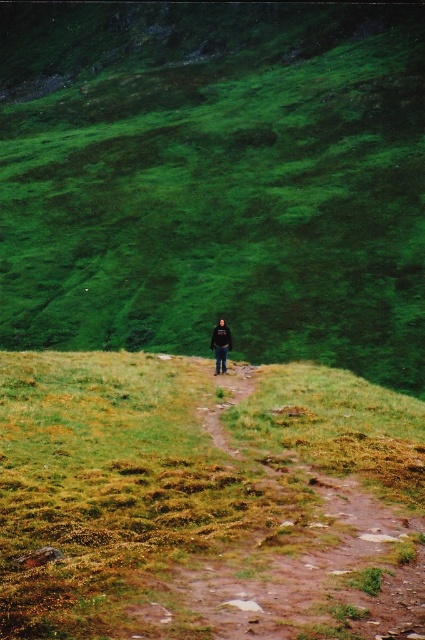
Does point (319, 563) lie in front of point (215, 372)?

That is True.

Does point (127, 580) lie in front of point (217, 364)?

Yes, it is in front of point (217, 364).

I want to click on green mossy ground at center, so click(x=204, y=500).

Between green grassy hillside at center and green mossy ground at center, which one has more height?

With more height is green grassy hillside at center.

Is point (231, 48) farther from camera compared to point (269, 520)?

Yes, it is.

Who is more forward, (353,237) or (84,465)?

Positioned in front is point (84,465).

This screenshot has height=640, width=425. In order to click on green grassy hillside at center in this screenshot , I will do `click(215, 180)`.

Between green grassy hillside at center and black fabric person at center, which one has less height?

With less height is black fabric person at center.

Which is more to the right, green grassy hillside at center or black fabric person at center?

From the viewer's perspective, black fabric person at center appears more on the right side.

Describe the element at coordinates (215, 180) in the screenshot. I see `green grassy hillside at center` at that location.

Find the location of a particular element. The height and width of the screenshot is (640, 425). green grassy hillside at center is located at coordinates (215, 180).